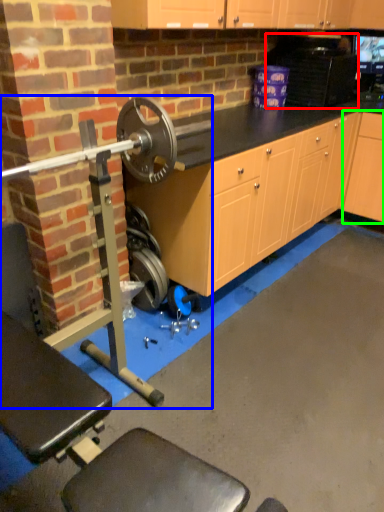
Question: Which is farther away from appliance (highlighted by a red box)? barbell (highlighted by a blue box) or cabinetry (highlighted by a green box)?

Choices:
 (A) barbell
 (B) cabinetry

Answer: (A)